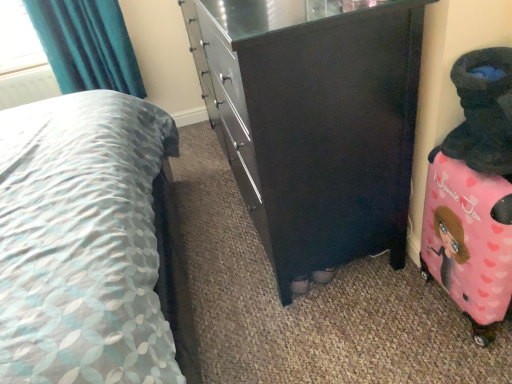
Identify the location of vacant space to the left of pink fabric suitcase at right. This screenshot has width=512, height=384. (395, 317).